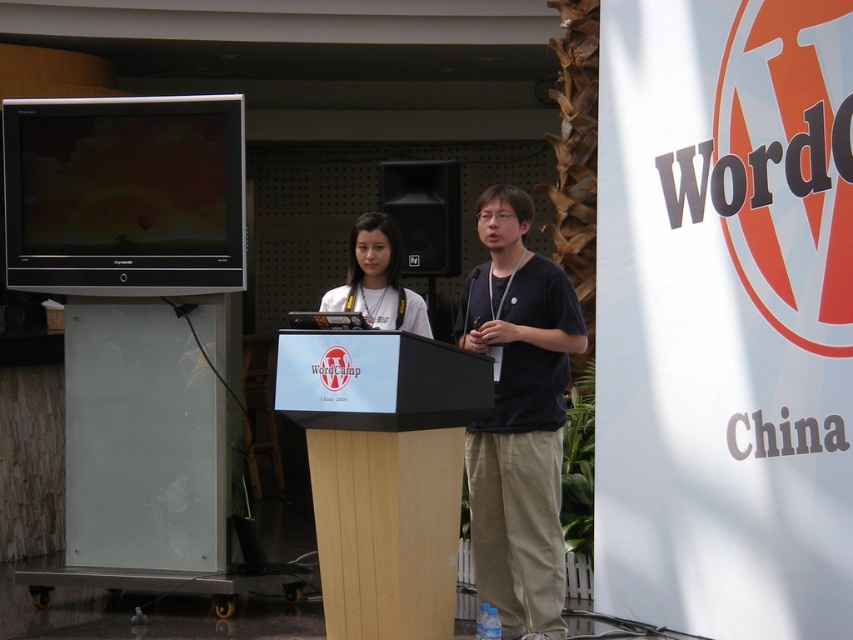
Between point (486, 595) and point (386, 214), which one is positioned in front?

Positioned in front is point (486, 595).

Find the location of `black matte shirt at center`. black matte shirt at center is located at coordinates (518, 417).

Between light brown wood podium at center and matte white shirt at center, which one appears on the left side from the viewer's perspective?

From the viewer's perspective, matte white shirt at center appears more on the left side.

Does light brown wood podium at center have a greater width compared to matte white shirt at center?

Yes.

Which is in front, point (428, 445) or point (367, 269)?

Point (428, 445) is in front.

I want to click on light brown wood podium at center, so click(383, 472).

Is light brown wood podium at center below black matte shirt at center?

Indeed, light brown wood podium at center is positioned under black matte shirt at center.

Between light brown wood podium at center and black matte shirt at center, which one has more height?

With more height is black matte shirt at center.

Which is in front, point (389, 477) or point (524, 316)?

Point (389, 477) is in front.

This screenshot has width=853, height=640. I want to click on light brown wood podium at center, so click(383, 472).